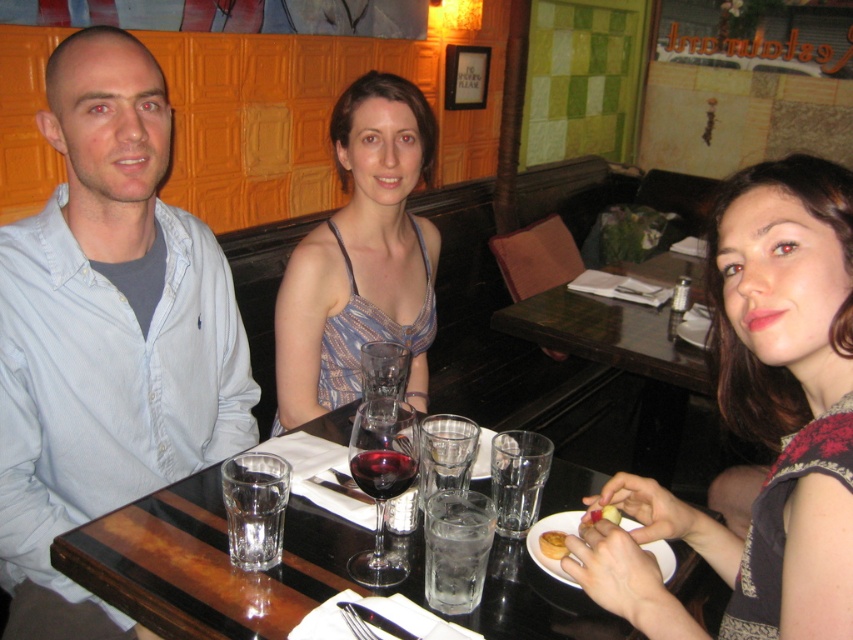
Is matte black dress at center shorter than blue printed dress at center?

Yes.

Which is more to the right, matte black dress at center or blue printed dress at center?

matte black dress at center is more to the right.

Who is more forward, (741, 376) or (299, 364)?

Point (741, 376) is in front.

Find the location of a particular element. matte black dress at center is located at coordinates (759, 420).

Describe the element at coordinates (759, 420) in the screenshot. I see `matte black dress at center` at that location.

Based on the photo, who is positioned more to the right, matte black dress at center or smooth apple at lower right?

matte black dress at center is more to the right.

I want to click on matte black dress at center, so click(x=759, y=420).

Where is `matte black dress at center`? The height and width of the screenshot is (640, 853). matte black dress at center is located at coordinates (759, 420).

From the picture: Between light blue shirt at center and matte black dress at center, which one has less height?

matte black dress at center is shorter.

Does light blue shirt at center have a smaller size compared to matte black dress at center?

Correct, light blue shirt at center occupies less space than matte black dress at center.

Identify the location of light blue shirt at center. This screenshot has width=853, height=640. (106, 333).